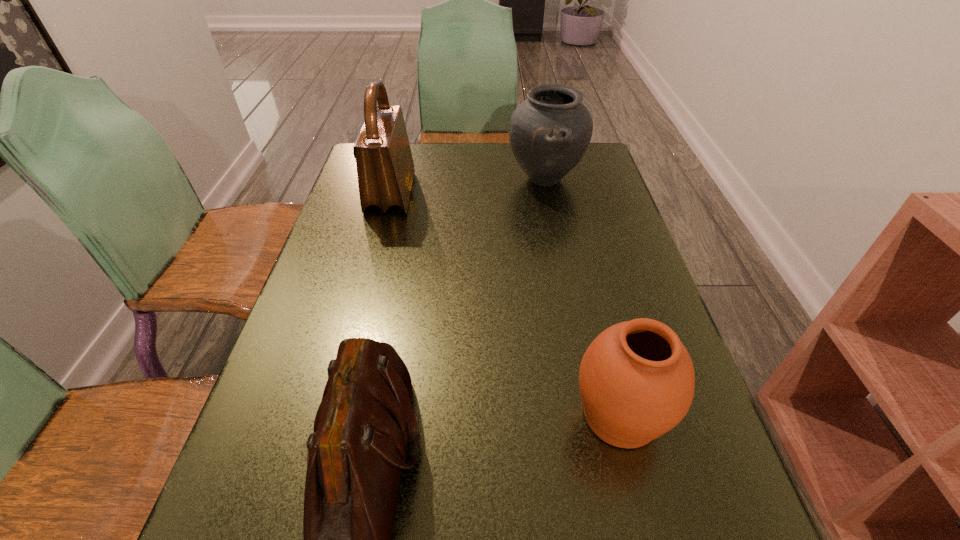
Identify the location of the tallest object. The height and width of the screenshot is (540, 960). (385, 168).

Where is `the taller shoulder bag`? The height and width of the screenshot is (540, 960). the taller shoulder bag is located at coordinates (385, 168).

Where is `the farther urn`? Image resolution: width=960 pixels, height=540 pixels. the farther urn is located at coordinates (550, 131).

This screenshot has height=540, width=960. I want to click on the shorter urn, so click(636, 379).

Locate an element on the screen. The width and height of the screenshot is (960, 540). the nearer urn is located at coordinates (636, 379).

Locate an element on the screen. vacant space located on the front flap of the taller shoulder bag is located at coordinates (547, 193).

Find the location of a particular element. Image resolution: width=960 pixels, height=540 pixels. vacant space located on the left of the taller urn is located at coordinates (448, 178).

Find the location of a particular element. The image size is (960, 540). free spot located 0.210m on the back of the shortest object is located at coordinates (590, 294).

Identify the location of shoulder bag that is positioned at the far edge. The image size is (960, 540). (385, 168).

You are a GUI agent. You are given a task and a screenshot of the screen. Output one action in this format:
    pyautogui.click(x=<x>, y=<y>)
    Task: Click on the urn that is at the far edge
    This screenshot has width=960, height=540.
    Given the screenshot: What is the action you would take?
    pyautogui.click(x=550, y=131)